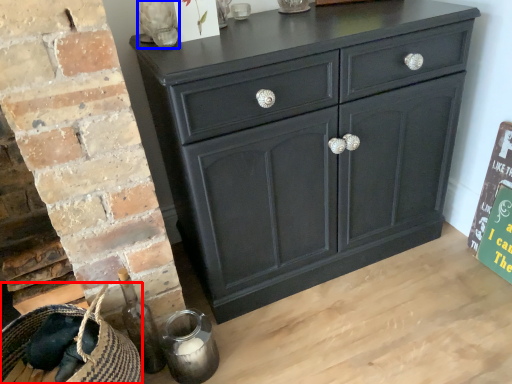
Question: Among these objects, which one is nearest to the camera, basket (highlighted by a red box) or glass vase (highlighted by a blue box)?

Choices:
 (A) basket
 (B) glass vase

Answer: (A)